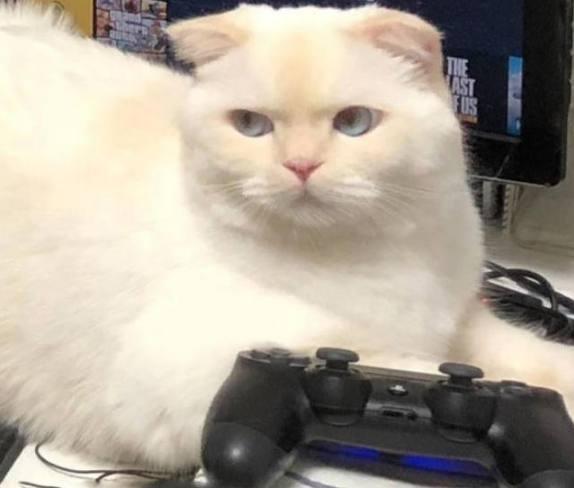
In order to click on led light in this screenshot , I will do [x=376, y=454], [x=414, y=458].